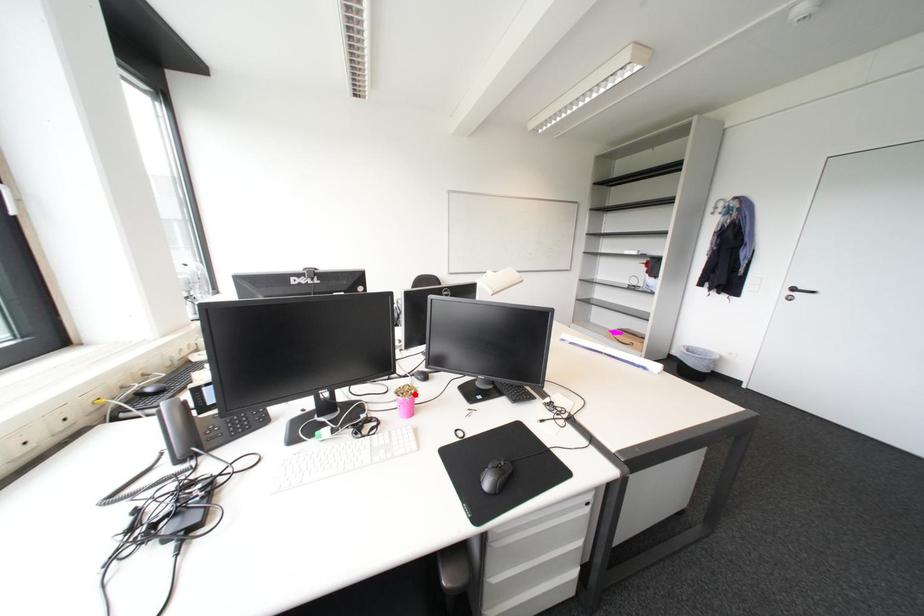
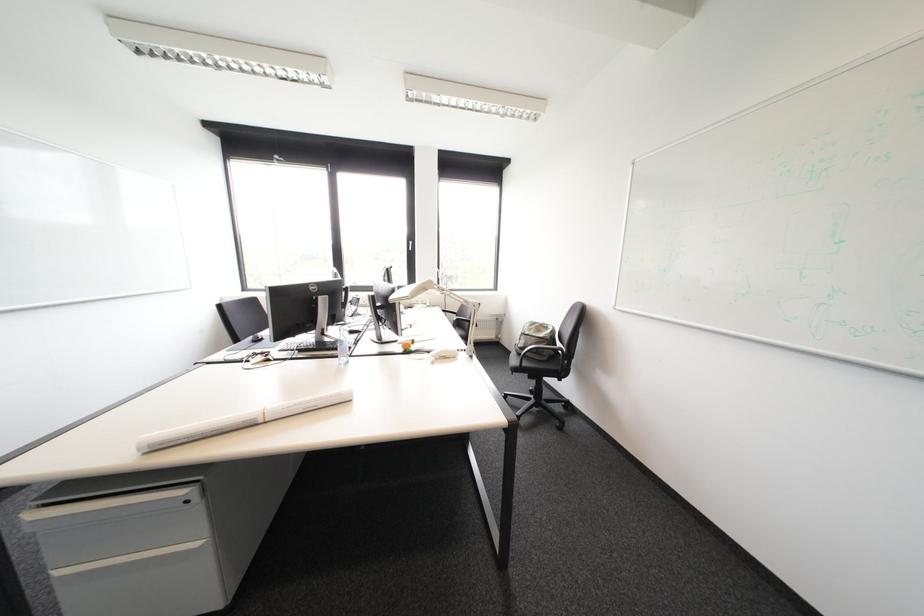
Question: I am providing you with two images of the same scene from different viewpoints. A red point is marked on the first image. Is the red point's position out of view in image 2?

Choices:
 (A) Yes
 (B) No

Answer: (A)